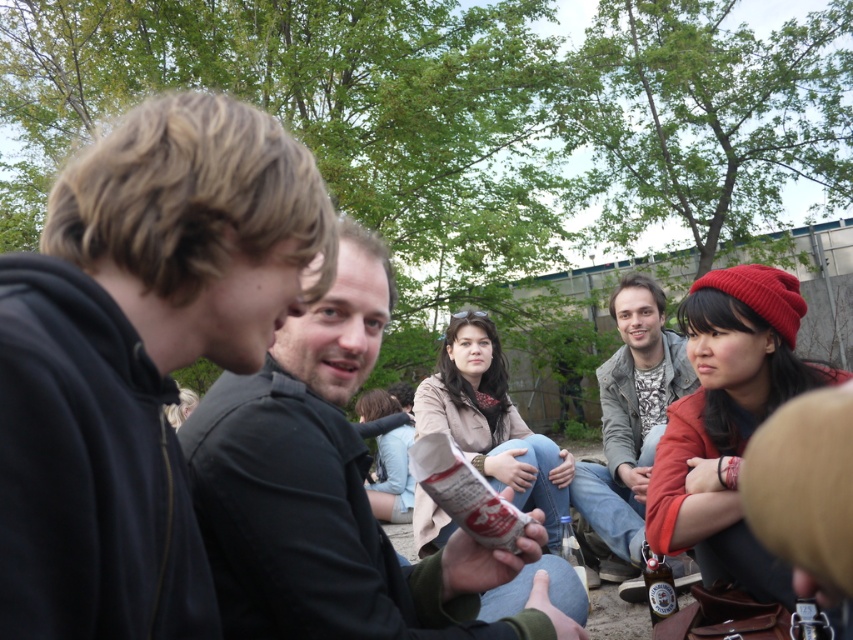
Who is shorter, black matte jacket at left or dark gray shirt at center?

Standing shorter between the two is black matte jacket at left.

Between point (105, 221) and point (482, 637), which one is positioned behind?

The point (482, 637) is more distant.

Measure the distance between black matte jacket at left and camera.

black matte jacket at left and camera are 31.59 inches apart from each other.

Where is `black matte jacket at left`? The height and width of the screenshot is (640, 853). black matte jacket at left is located at coordinates (138, 356).

Can you confirm if gray textured jacket at center is positioned to the right of metallic silver can at lower right?

Yes, gray textured jacket at center is to the right of metallic silver can at lower right.

Between gray textured jacket at center and metallic silver can at lower right, which one appears on the right side from the viewer's perspective?

gray textured jacket at center

What do you see at coordinates (631, 413) in the screenshot? This screenshot has height=640, width=853. I see `gray textured jacket at center` at bounding box center [631, 413].

The height and width of the screenshot is (640, 853). Identify the location of gray textured jacket at center. (631, 413).

Does black matte jacket at left have a lesser width compared to gray textured jacket at center?

Yes.

Between point (140, 625) and point (648, 364), which one is positioned behind?

Point (648, 364)

At what (x,y) coordinates should I click in order to perform the action: click on black matte jacket at left. Please return your answer as a coordinate pair (x, y). This screenshot has width=853, height=640. Looking at the image, I should click on (x=138, y=356).